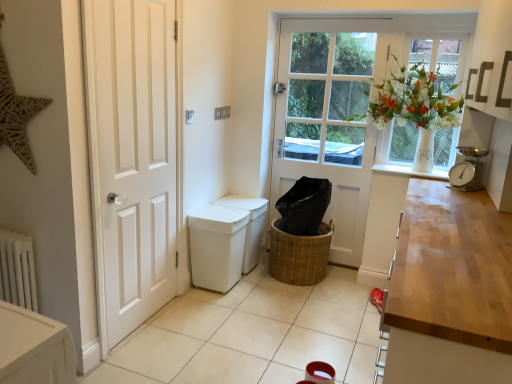
Identify the location of unoccupied region to the right of white glossy door at left, which ranks as the 2th door in back-to-front order. (209, 332).